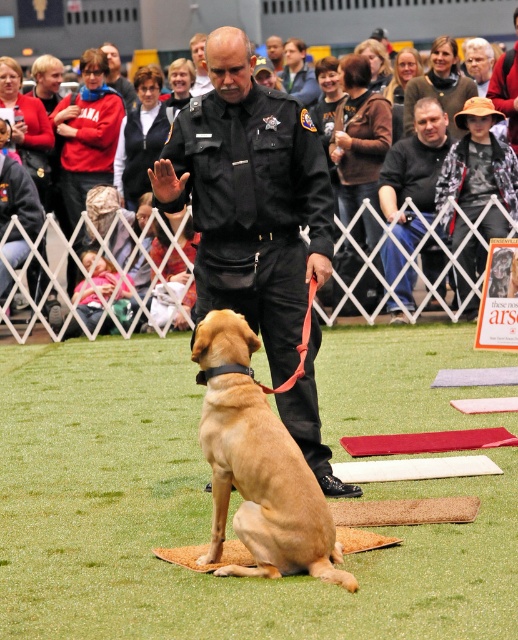
This screenshot has width=518, height=640. What do you see at coordinates (250, 198) in the screenshot?
I see `black uniform at center` at bounding box center [250, 198].

Does black uniform at center appear on the right side of golden fur dog at center?

Yes, black uniform at center is to the right of golden fur dog at center.

You are a GUI agent. You are given a task and a screenshot of the screen. Output one action in this format:
    pyautogui.click(x=<x>, y=<y>)
    Task: Click on the black uniform at center
    This screenshot has height=640, width=518.
    Given the screenshot: What is the action you would take?
    pyautogui.click(x=250, y=198)

Locate an element on the screen. black uniform at center is located at coordinates (250, 198).

Who is shorter, red cotton shirt at upper left or golden fur dog at center?

Standing shorter between the two is red cotton shirt at upper left.

The height and width of the screenshot is (640, 518). What are the coordinates of `red cotton shirt at upper left` in the screenshot? It's located at (238, 22).

Locate an element on the screen. The width and height of the screenshot is (518, 640). red cotton shirt at upper left is located at coordinates (238, 22).

Can you confirm if black uniform at center is positioned below red cotton shirt at upper left?

→ Indeed, black uniform at center is positioned under red cotton shirt at upper left.

The height and width of the screenshot is (640, 518). Describe the element at coordinates (250, 198) in the screenshot. I see `black uniform at center` at that location.

Is point (181, 113) positioned behind point (294, 70)?

That is False.

Locate an element on the screen. This screenshot has height=640, width=518. black uniform at center is located at coordinates (250, 198).